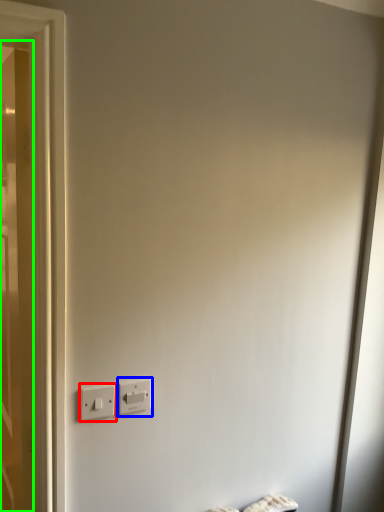
Question: Which object is positioned closest to power plugs and sockets (highlighted by a red box)? Select from power plugs and sockets (highlighted by a blue box) and door (highlighted by a green box).

Choices:
 (A) power plugs and sockets
 (B) door

Answer: (A)